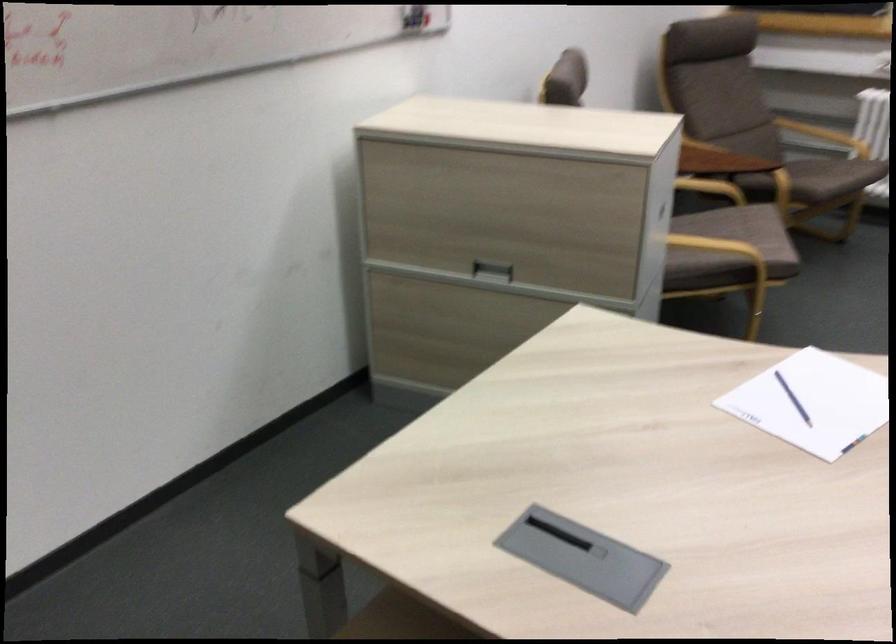
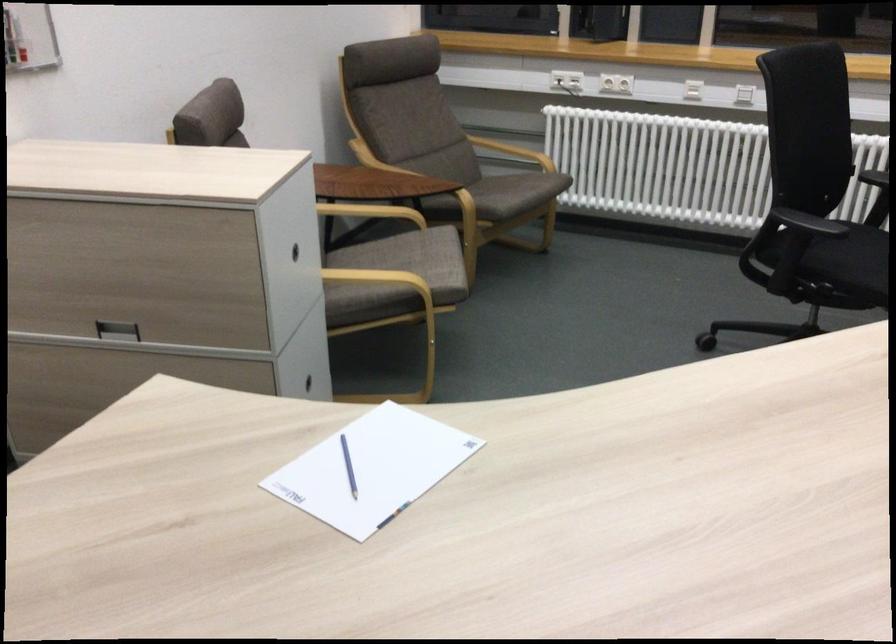
Find the pixel in the second image that matches point 738,231 in the first image.

(412, 259)